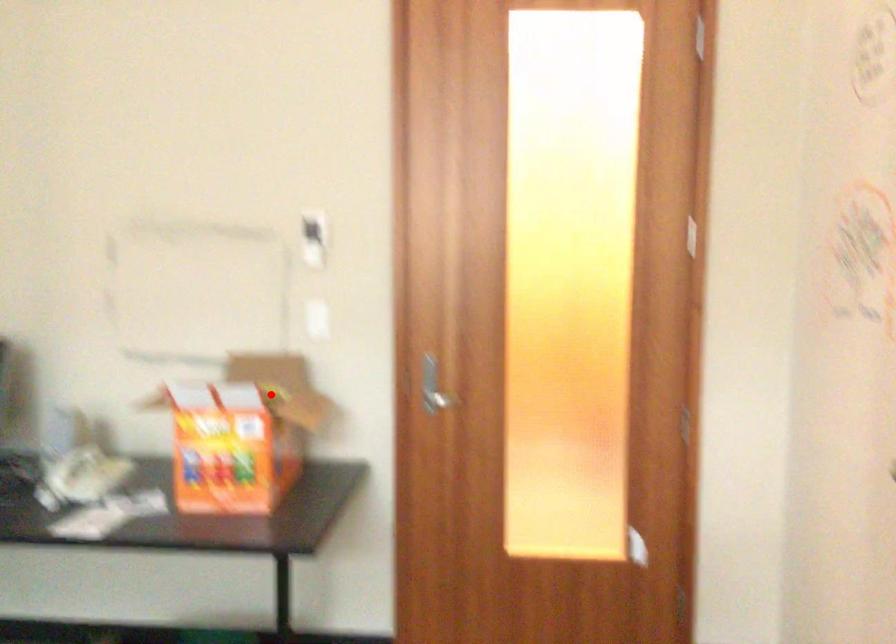
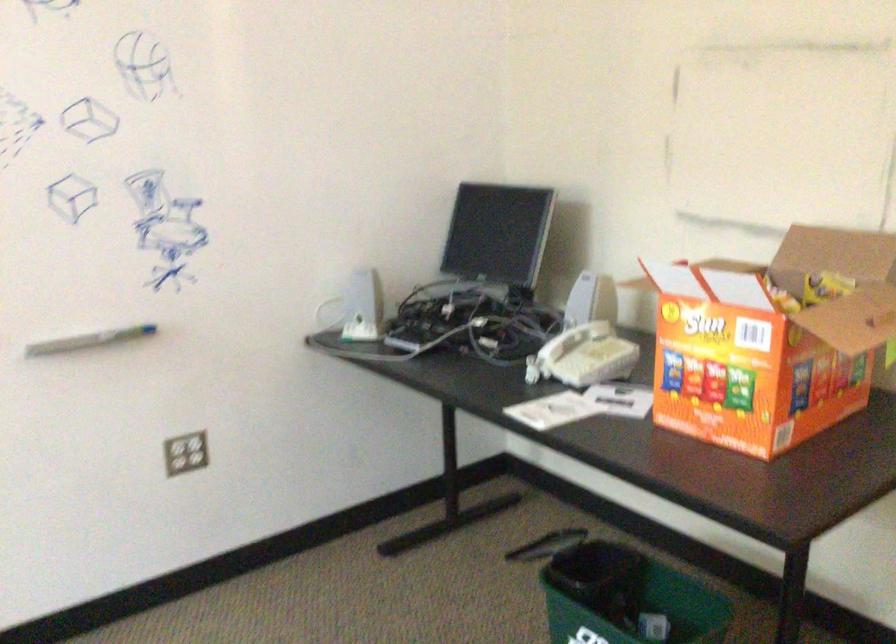
Question: I am providing you with two images of the same scene from different viewpoints. Given a red point in image1, look at the same physical point in image2. Is it:

Choices:
 (A) Closer to the viewpoint
 (B) Farther from the viewpoint

Answer: (A)